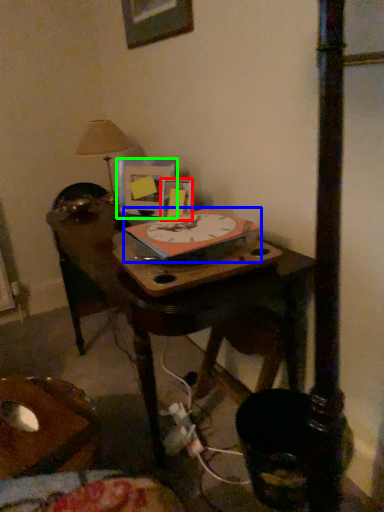
Question: Which is farther away from picture frame (highlighted by a red box)? clock (highlighted by a blue box) or picture frame (highlighted by a green box)?

Choices:
 (A) clock
 (B) picture frame

Answer: (A)